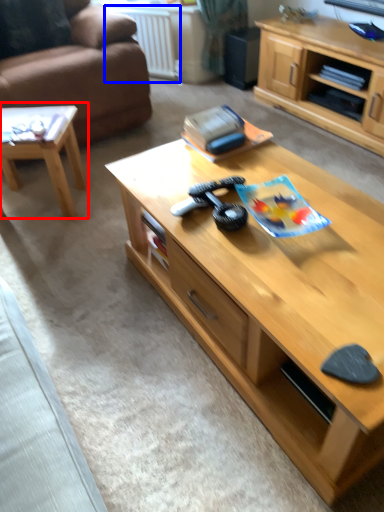
Question: Which object is closer to the camera taking this photo, coffee table (highlighted by a red box) or radiator (highlighted by a blue box)?

Choices:
 (A) coffee table
 (B) radiator

Answer: (A)